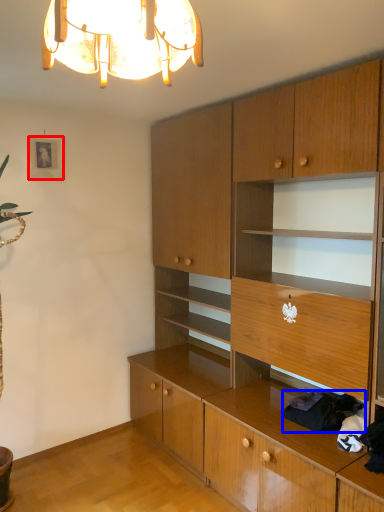
Question: Which object is further to the camera taking this photo, picture frame (highlighted by a red box) or clothing (highlighted by a blue box)?

Choices:
 (A) picture frame
 (B) clothing

Answer: (A)